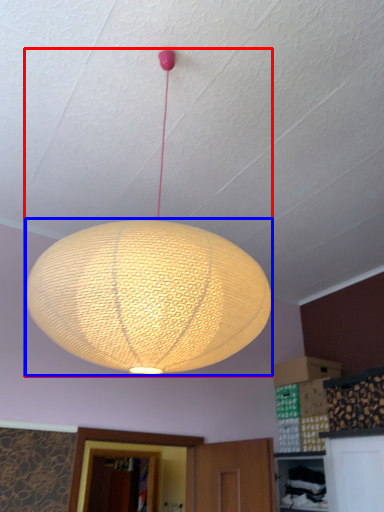
Question: Which object is further to the camera taking this photo, lamp (highlighted by a red box) or lantern (highlighted by a blue box)?

Choices:
 (A) lamp
 (B) lantern

Answer: (B)